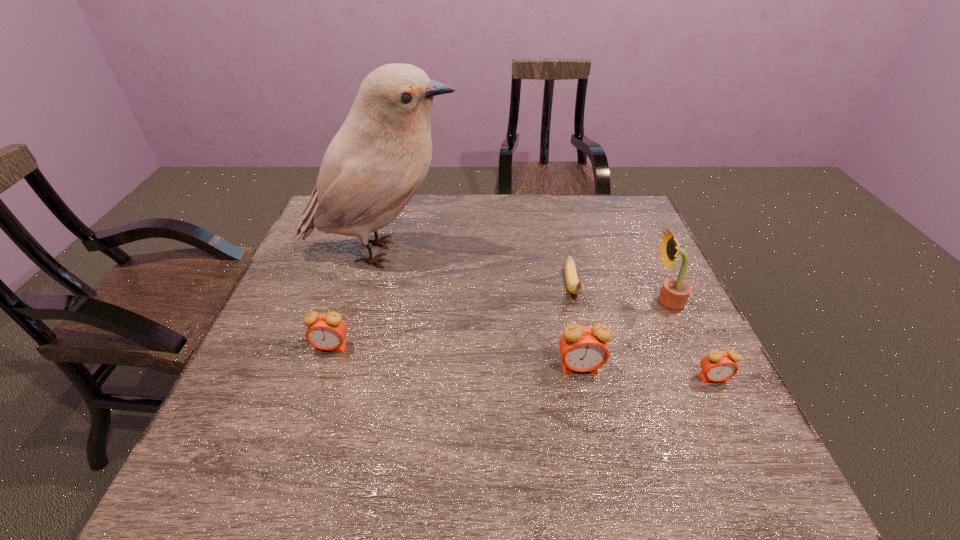
At what (x,y) coordinates should I click in order to perform the action: click on vacant spot for a new alarm_clock to ensure equal spacing. Please return your answer as a coordinate pair (x, y). The height and width of the screenshot is (540, 960). Looking at the image, I should click on (453, 357).